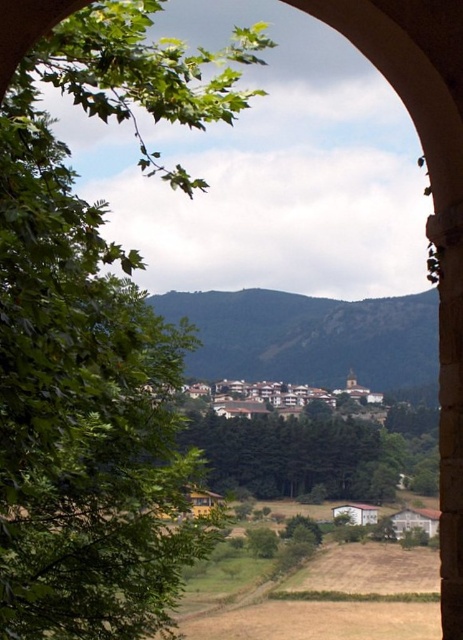
You are an architect designing a garden path that needs to pass between the green leafy tree at left and the green grassy hill at center. Based on their widths, which one will require more space to avoid collision?

The green grassy hill at center requires more space because it is wider than the green leafy tree at left.

Looking at this image, you are standing in front of the arched opening and want to take a photo of both the point at coordinates point (187, 52) and the point at coordinates point (320, 484). Which point is closer to the camera?

Point (187, 52) is further to the camera than point (320, 484), so the point at coordinates point (320, 484) is closer to the camera.